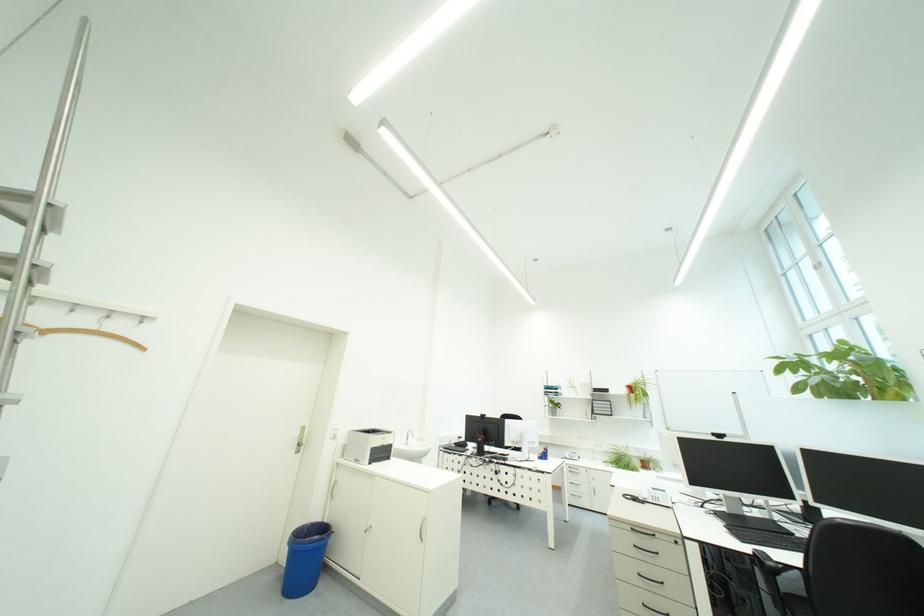
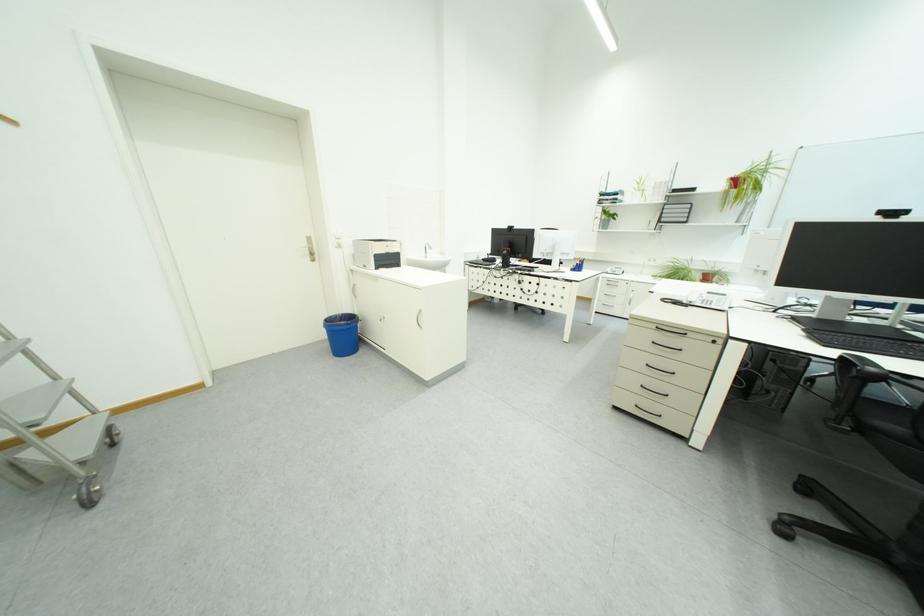
Locate, in the second image, the point that corresponds to pixel 724 437 in the first image.

(893, 215)